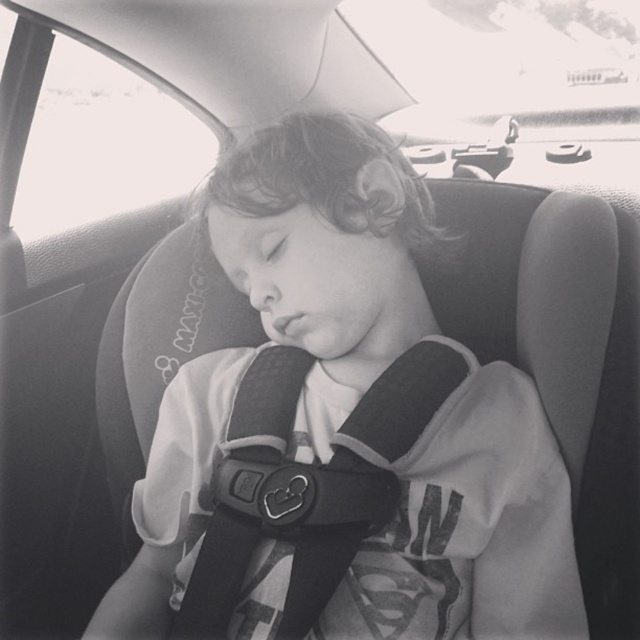
Question: Can you confirm if smooth fabric shirt at center is positioned to the right of black fabric seatbelt at center?

Choices:
 (A) no
 (B) yes

Answer: (A)

Question: Does smooth fabric shirt at center come behind black fabric seatbelt at center?

Choices:
 (A) no
 (B) yes

Answer: (B)

Question: Which point is closer to the camera?

Choices:
 (A) (385, 554)
 (B) (214, 566)

Answer: (A)

Question: Does smooth fabric shirt at center have a greater width compared to black fabric seatbelt at center?

Choices:
 (A) no
 (B) yes

Answer: (B)